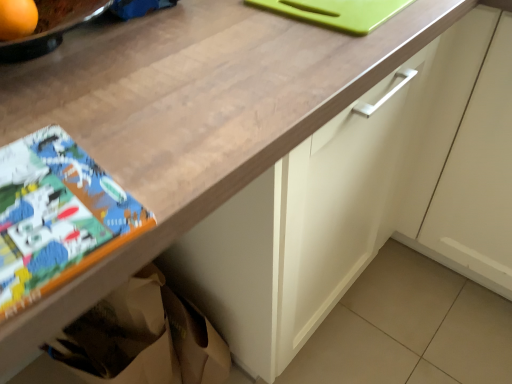
At what (x,y) coordinates should I click in order to perform the action: click on free space above matte paper comic book at lower left (from a real-world perspective). Please return your answer as a coordinate pair (x, y). Image resolution: width=512 pixels, height=384 pixels. Looking at the image, I should click on (39, 208).